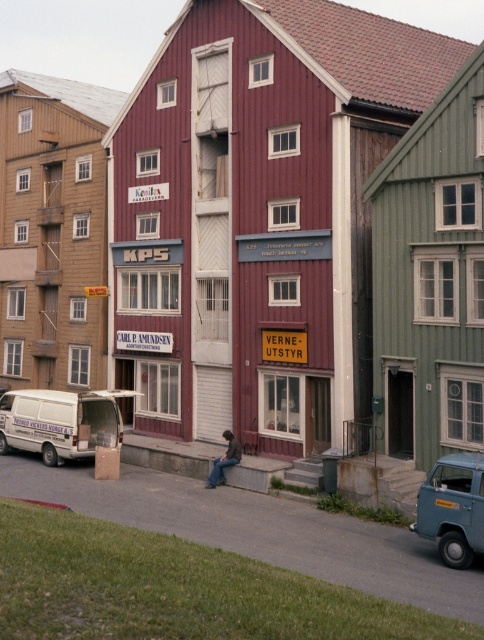
Who is positioned more to the right, white matte van at lower left or blue matte minivan at lower right?

From the viewer's perspective, blue matte minivan at lower right appears more on the right side.

Can you confirm if white matte van at lower left is wider than blue matte minivan at lower right?

No, white matte van at lower left is not wider than blue matte minivan at lower right.

Is point (91, 419) more distant than point (468, 557)?

Yes, point (91, 419) is farther from viewer.

The image size is (484, 640). Identify the location of white matte van at lower left. (60, 420).

Does point (456, 536) come farther from viewer compared to point (226, 451)?

No.

Between blue matte minivan at lower right and dark blue jeans at center, which one appears on the right side from the viewer's perspective?

blue matte minivan at lower right

Does point (471, 540) lie behind point (236, 456)?

No, it is not.

Find the location of a particular element. blue matte minivan at lower right is located at coordinates (453, 508).

Can you confirm if white matte van at lower left is positioned to the left of gray concrete curb at lower center?

Indeed, white matte van at lower left is positioned on the left side of gray concrete curb at lower center.

Where is `white matte van at lower left`? white matte van at lower left is located at coordinates (60, 420).

This screenshot has height=640, width=484. I want to click on white matte van at lower left, so click(x=60, y=420).